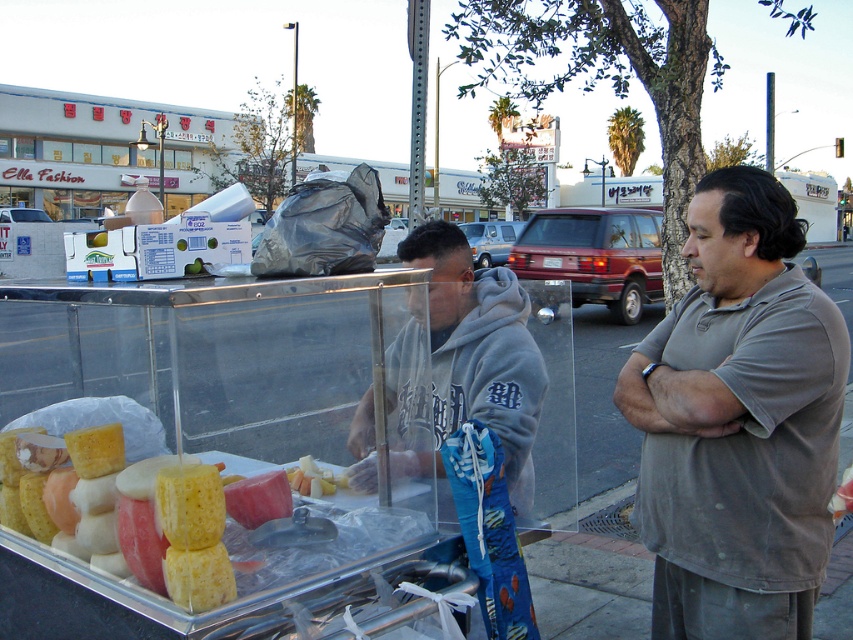
Between gray cotton shirt at right and gray fleece hoodie at center, which one appears on the left side from the viewer's perspective?

gray fleece hoodie at center

Can you confirm if gray cotton shirt at right is positioned above gray fleece hoodie at center?

No, gray cotton shirt at right is not above gray fleece hoodie at center.

The image size is (853, 640). What are the coordinates of `gray cotton shirt at right` in the screenshot? It's located at (738, 422).